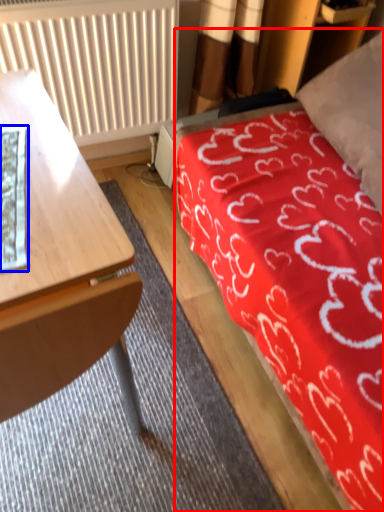
Question: Which object appears closest to the camera in this image, bed (highlighted by a red box) or sheet (highlighted by a blue box)?

Choices:
 (A) bed
 (B) sheet

Answer: (A)